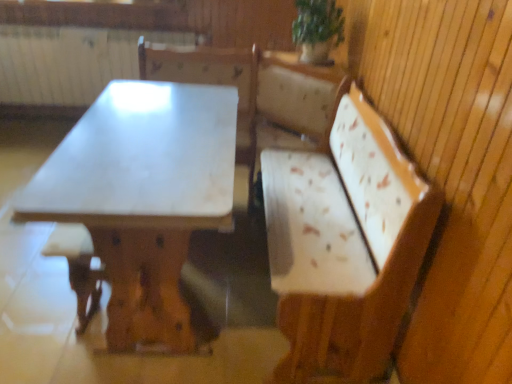
Where is `white marble table at center`? The image size is (512, 384). white marble table at center is located at coordinates (143, 197).

This screenshot has height=384, width=512. Identify the location of brown wood step stool at lower left. click(77, 267).

Is green leafy plant at upper center not near white painted radiator at upper left?

Yes, green leafy plant at upper center and white painted radiator at upper left are located far from each other.

Which is behind, point (308, 5) or point (116, 64)?

Positioned behind is point (116, 64).

Is green leafy plant at upper center in front of brown wood step stool at lower left?

No, it is not.

Based on their sizes in the image, would you say green leafy plant at upper center is bigger or smaller than brown wood step stool at lower left?

green leafy plant at upper center is smaller than brown wood step stool at lower left.

From a real-world perspective, which is physically below, green leafy plant at upper center or brown wood step stool at lower left?

In real-world perspective, brown wood step stool at lower left is lower.

Does point (303, 19) come in front of point (44, 248)?

That is False.

Is white marble table at center far away from brown wood step stool at lower left?

white marble table at center is actually quite close to brown wood step stool at lower left.

In the image, is white marble table at center positioned in front of or behind brown wood step stool at lower left?

white marble table at center is in front of brown wood step stool at lower left.

Is white marble table at center located outside brown wood step stool at lower left?

white marble table at center is positioned outside brown wood step stool at lower left.

Between point (195, 171) and point (86, 296), which one is positioned behind?

Point (86, 296)

Is white marble table at center facing away from green leafy plant at upper center?

That's not correct — white marble table at center is not looking away from green leafy plant at upper center.

Is white marble table at center touching green leafy plant at upper center?

white marble table at center and green leafy plant at upper center are not in contact.

Is white marble table at center completely or partially outside of green leafy plant at upper center?

Yes, white marble table at center is located beyond the bounds of green leafy plant at upper center.

Looking at this image, from a real-world perspective, which is physically above, white marble table at center or green leafy plant at upper center?

green leafy plant at upper center.

Is white painted radiator at upper left not within white marble table at center?

Yes, white painted radiator at upper left is outside of white marble table at center.

Considering the relative positions of white painted radiator at upper left and white marble table at center in the image provided, is white painted radiator at upper left to the right of white marble table at center from the viewer's perspective?

In fact, white painted radiator at upper left is to the left of white marble table at center.

Considering the relative sizes of white painted radiator at upper left and white marble table at center in the image provided, is white painted radiator at upper left smaller than white marble table at center?

Yes, white painted radiator at upper left is smaller than white marble table at center.

Considering the relative positions of white painted radiator at upper left and white marble table at center in the image provided, is white painted radiator at upper left behind white marble table at center?

Yes, white painted radiator at upper left is further from the viewer.

Is white painted radiator at upper left not inside green leafy plant at upper center?

Yes, white painted radiator at upper left is located beyond the bounds of green leafy plant at upper center.

From the image's perspective, between white painted radiator at upper left and green leafy plant at upper center, who is located below?

green leafy plant at upper center.

Which of these two, white painted radiator at upper left or green leafy plant at upper center, is smaller?

With smaller size is green leafy plant at upper center.

Between white painted radiator at upper left and green leafy plant at upper center, which one is positioned in front?

green leafy plant at upper center is more forward.

Can you confirm if white marble table at center is thinner than white painted radiator at upper left?

No.

From a real-world perspective, is white marble table at center beneath white painted radiator at upper left?

Yes.

From the image's perspective, is white marble table at center located beneath white painted radiator at upper left?

Yes, from the image's perspective, white marble table at center is below white painted radiator at upper left.

How much distance is there between white marble table at center and white painted radiator at upper left?

white marble table at center is 5.58 feet from white painted radiator at upper left.

Where is `plant in front of the white painted radiator at upper left`? The height and width of the screenshot is (384, 512). plant in front of the white painted radiator at upper left is located at coordinates (318, 22).

The image size is (512, 384). What are the coordinates of `plant lying above the brown wood step stool at lower left (from the image's perspective)` in the screenshot? It's located at click(x=318, y=22).

Looking at the image, which one is located closer to brown wood step stool at lower left, white painted radiator at upper left or white marble table at center?

white marble table at center.

Considering their positions, is green leafy plant at upper center positioned further to white painted radiator at upper left than white marble table at center?

green leafy plant at upper center.

Looking at the image, which one is located closer to white marble table at center, green leafy plant at upper center or white painted radiator at upper left?

Based on the image, green leafy plant at upper center appears to be nearer to white marble table at center.

From the image, which object appears to be nearer to brown wood step stool at lower left, green leafy plant at upper center or white marble table at center?

white marble table at center is positioned closer to the anchor brown wood step stool at lower left.

When comparing their distances from green leafy plant at upper center, does brown wood step stool at lower left or white painted radiator at upper left seem closer?

brown wood step stool at lower left lies closer to green leafy plant at upper center than the other object.

Which object lies nearer to the anchor point white painted radiator at upper left, brown wood step stool at lower left or white marble table at center?

white marble table at center lies closer to white painted radiator at upper left than the other object.

Looking at the image, which one is located closer to white painted radiator at upper left, white marble table at center or brown wood step stool at lower left?

white marble table at center is closer to white painted radiator at upper left.

When comparing their distances from white marble table at center, does brown wood step stool at lower left or green leafy plant at upper center seem closer?

Among the two, brown wood step stool at lower left is located nearer to white marble table at center.

Identify the location of step stool positioned between white marble table at center and white painted radiator at upper left from near to far. This screenshot has height=384, width=512. (77, 267).

At what (x,y) coordinates should I click in order to perform the action: click on plant positioned between white marble table at center and white painted radiator at upper left from near to far. Please return your answer as a coordinate pair (x, y). The width and height of the screenshot is (512, 384). Looking at the image, I should click on (318, 22).

I want to click on step stool between white painted radiator at upper left and green leafy plant at upper center from left to right, so click(77, 267).

Where is `table between green leafy plant at upper center and brown wood step stool at lower left in the up-down direction`? table between green leafy plant at upper center and brown wood step stool at lower left in the up-down direction is located at coordinates (143, 197).